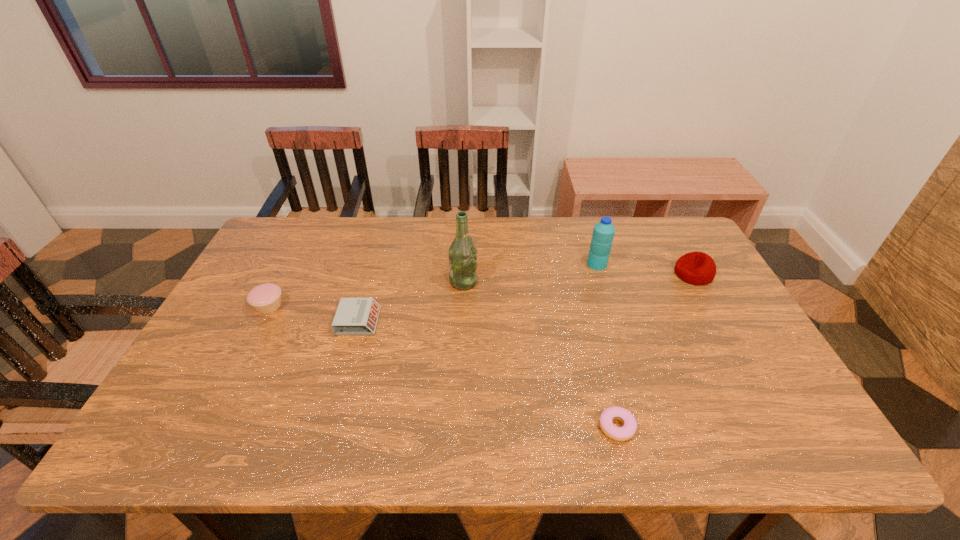
What are the coordinates of `the tallest object` in the screenshot? It's located at 462,254.

Locate an element on the screen. The width and height of the screenshot is (960, 540). beer bottle is located at coordinates (462, 254).

Where is `water bottle`? The width and height of the screenshot is (960, 540). water bottle is located at coordinates (603, 233).

Locate an element on the screen. The height and width of the screenshot is (540, 960). the rightmost object is located at coordinates (697, 268).

Find the location of a particular element. The height and width of the screenshot is (540, 960). beanbag is located at coordinates (697, 268).

Locate an element on the screen. Image resolution: width=960 pixels, height=540 pixels. cupcake is located at coordinates (266, 298).

Locate an element on the screen. The height and width of the screenshot is (540, 960). the leftmost object is located at coordinates (266, 298).

At what (x,y) coordinates should I click in order to perform the action: click on the fifth object from right to left. Please return your answer as a coordinate pair (x, y). The height and width of the screenshot is (540, 960). Looking at the image, I should click on (355, 316).

The width and height of the screenshot is (960, 540). In order to click on alarm clock in this screenshot , I will do click(355, 316).

You are a GUI agent. You are given a task and a screenshot of the screen. Output one action in this format:
    pyautogui.click(x=<x>, y=<y>)
    Task: Click on the doughnut
    
    Given the screenshot: What is the action you would take?
    pyautogui.click(x=627, y=431)